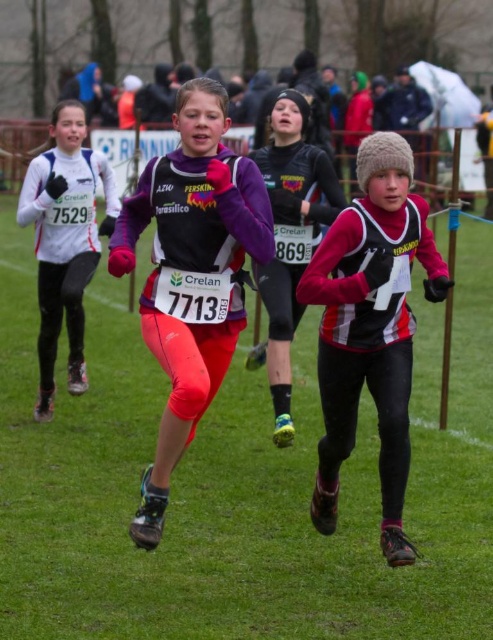
You are a race official trying to locate the runner wearing the purple matte running suit at center. According to the coordinates provided, where should you look to find them?

The purple matte running suit at center is located at the 2D coordinates point (190, 273).

You are a spectator at the cross country race. You see the white matte running suit at left and the matte purple jacket at center. Which runner is closer to you?

The white matte running suit at left is closer to you because it is further to the viewer than the matte purple jacket at center.

You are a photographer at the cross country event. You want to take a photo of the two runners wearing the matte red and black running suit at center and the matte purple jacket at center. Which runner should you focus on to ensure their clothing details are clearer in the photo?

The matte red and black running suit at center is bigger than the matte purple jacket at center, so focusing on the matte red and black running suit at center will provide clearer clothing details because it is larger and occupies more of the frame.